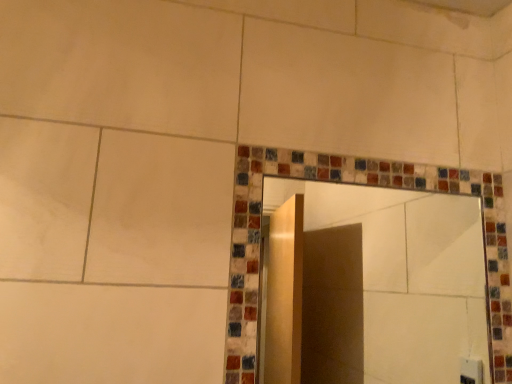
What do you see at coordinates (398, 276) in the screenshot? The height and width of the screenshot is (384, 512). I see `multicolored mosaic mirror at center` at bounding box center [398, 276].

In the scene shown: Measure the distance between point [456,206] and camera.

Point [456,206] is 4.32 feet from camera.

Where is `multicolored mosaic mirror at center`? multicolored mosaic mirror at center is located at coordinates (398, 276).

This screenshot has width=512, height=384. Identify the location of multicolored mosaic mirror at center. (398, 276).